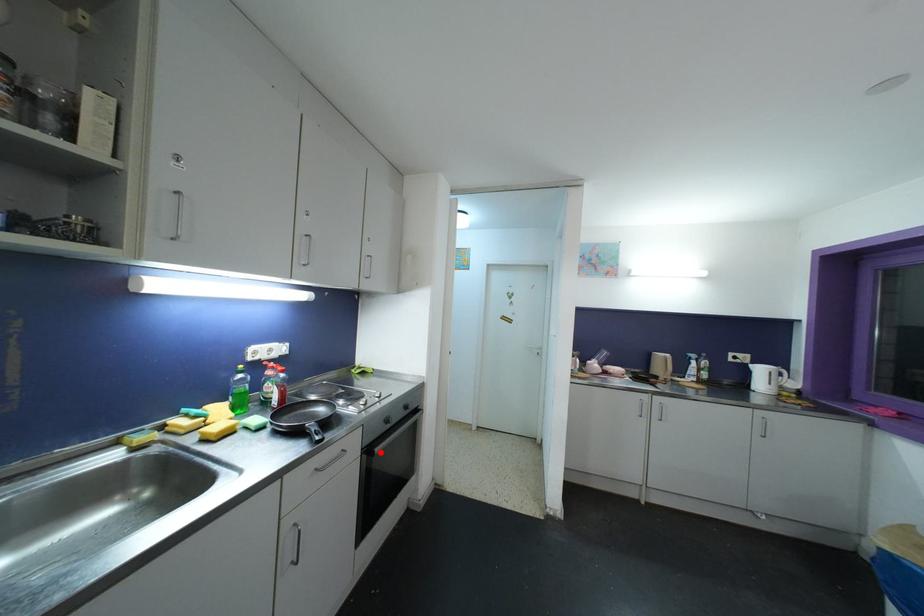
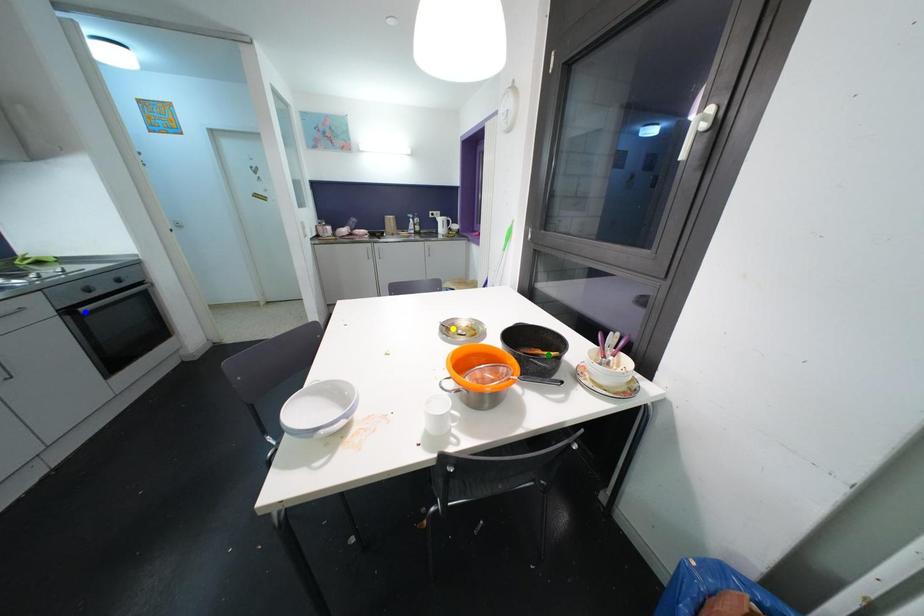
Question: I am providing you with two images of the same scene from different viewpoints. A red point is marked on the first image. You are given multiple points on the second image. Which mark in image 2 goes with the point in image 1?

Choices:
 (A) blue point
 (B) yellow point
 (C) green point

Answer: (A)